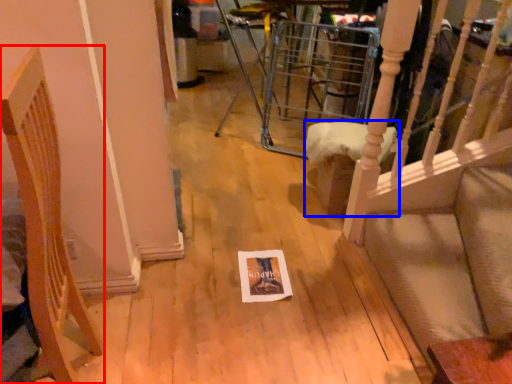
Question: Among these objects, which one is farthest to the camera, furniture (highlighted by a red box) or furniture (highlighted by a blue box)?

Choices:
 (A) furniture
 (B) furniture

Answer: (B)